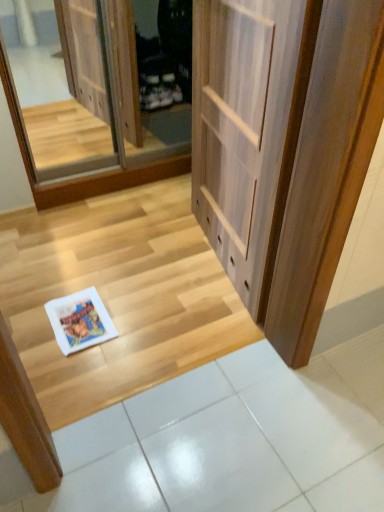
Question: From the image's perspective, is clear glass screen door at upper left on white glossy tile at lower center?

Choices:
 (A) no
 (B) yes

Answer: (B)

Question: Is clear glass screen door at upper left not inside white glossy tile at lower center?

Choices:
 (A) yes
 (B) no

Answer: (A)

Question: Is clear glass screen door at upper left positioned with its back to white glossy tile at lower center?

Choices:
 (A) no
 (B) yes

Answer: (A)

Question: From a real-world perspective, does clear glass screen door at upper left sit lower than white glossy tile at lower center?

Choices:
 (A) no
 (B) yes

Answer: (A)

Question: Is clear glass screen door at upper left positioned in front of white glossy tile at lower center?

Choices:
 (A) yes
 (B) no

Answer: (B)

Question: Would you say white paper magazine at lower left is to the left or to the right of white glossy tile at lower center in the picture?

Choices:
 (A) left
 (B) right

Answer: (A)

Question: Do you think white paper magazine at lower left is within white glossy tile at lower center, or outside of it?

Choices:
 (A) inside
 (B) outside

Answer: (B)

Question: Considering the positions of point (49, 304) and point (286, 495), is point (49, 304) closer or farther from the camera than point (286, 495)?

Choices:
 (A) farther
 (B) closer

Answer: (A)

Question: Considering their positions, is white paper magazine at lower left located in front of or behind white glossy tile at lower center?

Choices:
 (A) front
 (B) behind

Answer: (B)

Question: Based on their sizes in the image, would you say white paper magazine at lower left is bigger or smaller than light wood door at center?

Choices:
 (A) small
 (B) big

Answer: (A)

Question: From the image's perspective, is white paper magazine at lower left located above or below light wood door at center?

Choices:
 (A) below
 (B) above

Answer: (A)

Question: Looking at their shapes, would you say white paper magazine at lower left is wider or thinner than light wood door at center?

Choices:
 (A) thin
 (B) wide

Answer: (B)

Question: Based on their positions, is white paper magazine at lower left located to the left or right of light wood door at center?

Choices:
 (A) right
 (B) left

Answer: (B)

Question: Would you say wooden floor at lower left is to the left or to the right of light wood door at center in the picture?

Choices:
 (A) right
 (B) left

Answer: (B)

Question: Is point (157, 348) closer or farther from the camera than point (372, 131)?

Choices:
 (A) farther
 (B) closer

Answer: (A)